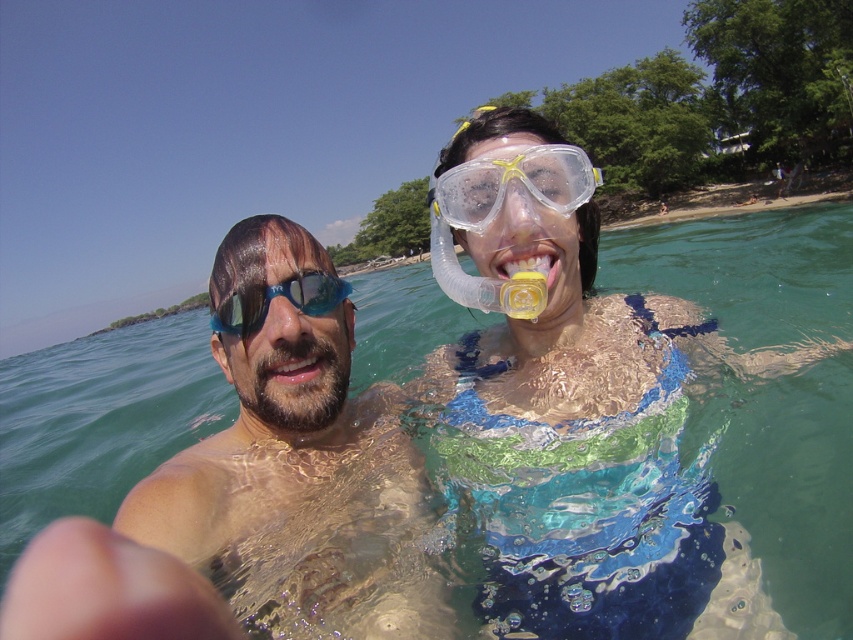
Between transparent plastic snorkel at center and yellow rubber mouth at center, which one appears on the right side from the viewer's perspective?

yellow rubber mouth at center

Is transparent plastic snorkel at center wider than yellow rubber mouth at center?

In fact, transparent plastic snorkel at center might be narrower than yellow rubber mouth at center.

Identify the location of transparent plastic snorkel at center. Image resolution: width=853 pixels, height=640 pixels. (519, 216).

Who is shorter, shiny blue goggles at center or clear blue water at center?

Standing shorter between the two is shiny blue goggles at center.

Is point (410, 637) positioned in front of point (614, 273)?

Yes, point (410, 637) is closer to viewer.

Between point (218, 330) and point (407, 346), which one is positioned behind?

Point (407, 346)

The image size is (853, 640). In order to click on shiny blue goggles at center in this screenshot , I will do `click(296, 470)`.

Who is positioned more to the left, transparent plastic goggles at center or transparent plastic snorkel at center?

Positioned to the left is transparent plastic snorkel at center.

Can you confirm if transparent plastic goggles at center is positioned to the right of transparent plastic snorkel at center?

Correct, you'll find transparent plastic goggles at center to the right of transparent plastic snorkel at center.

Find the location of `transparent plastic goggles at center`. transparent plastic goggles at center is located at coordinates (512, 179).

At what (x,y) coordinates should I click in order to perform the action: click on transparent plastic goggles at center. Please return your answer as a coordinate pair (x, y). The image size is (853, 640). Looking at the image, I should click on (512, 179).